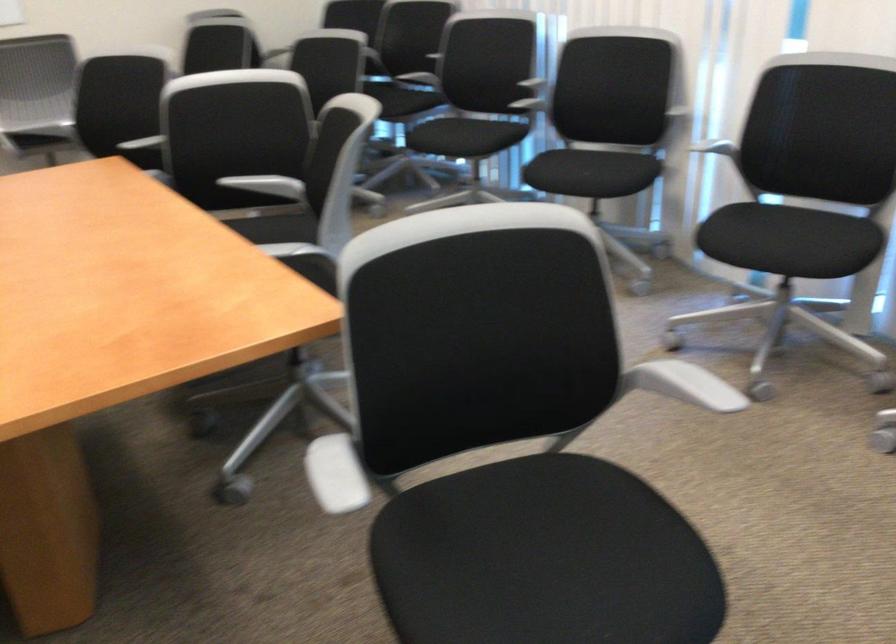
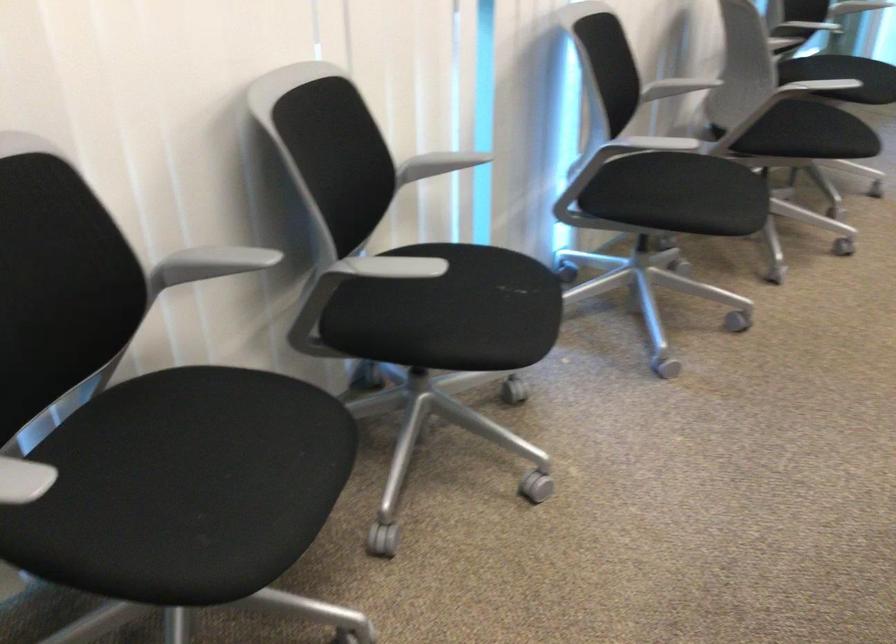
In the second image, find the point that corresponds to point 737,225 in the first image.

(679, 194)